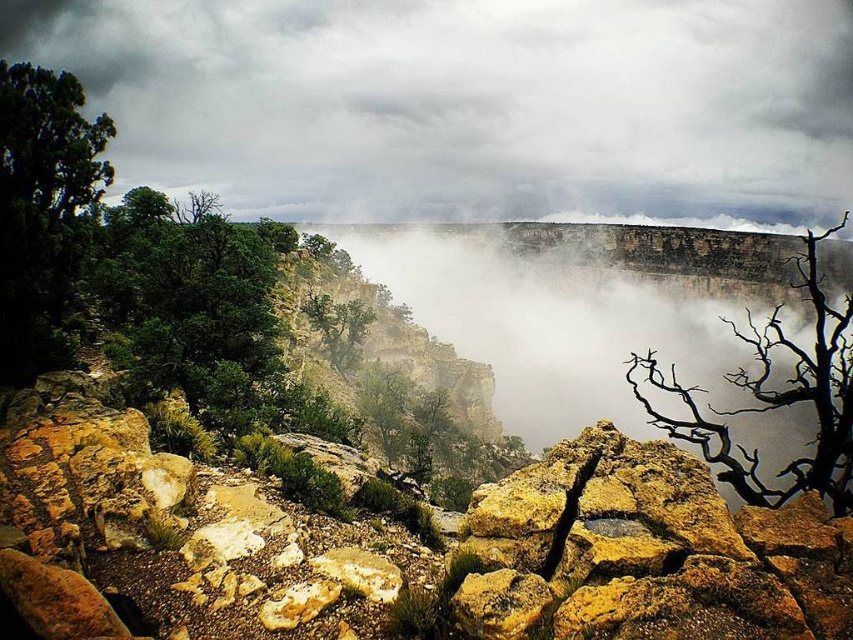
You are standing at the edge of the canyon in the image and want to move towards the two points marked. Which point, point (715, 410) or point (515, 608), is closer to you?

Point (515, 608) is closer to you because it is less further to the camera than point (715, 410).

You are an explorer trying to navigate through the canyon. You see the foggy mist at center and the green leafy tree at left. Which one takes up more area in the image?

The green leafy tree at left takes up more area than the foggy mist at center.

You are a hiker trying to navigate through the canyon. You notice the foggy mist at center and the yellowish rock at center. Which one is taller from your viewpoint?

The foggy mist at center has a greater height compared to the yellowish rock at center, so the foggy mist at center is taller.